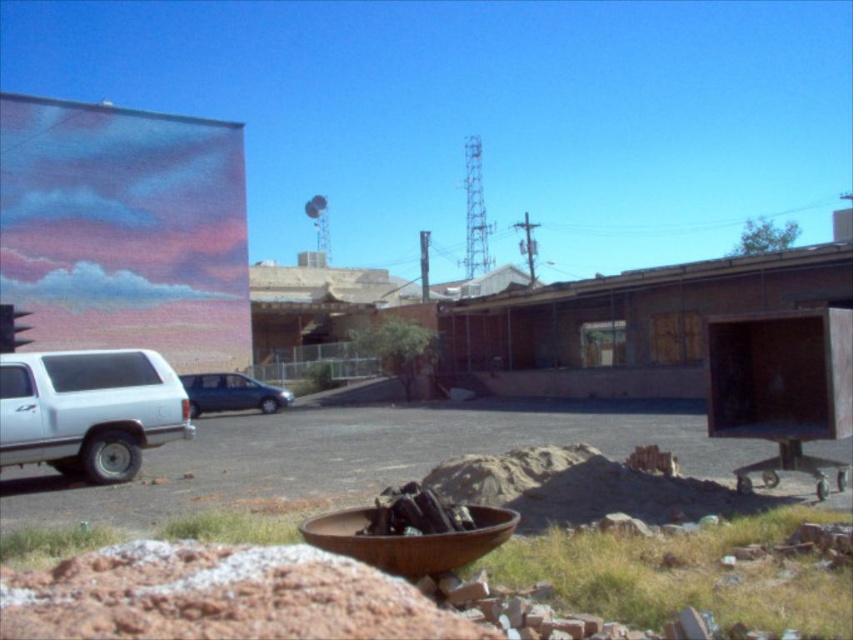
How much distance is there between white matte truck at left and satin blue sedan at center?

white matte truck at left is 15.66 meters from satin blue sedan at center.

Between point (160, 428) and point (227, 384), which one is positioned behind?

Positioned behind is point (227, 384).

Where is `white matte truck at left`? The image size is (853, 640). white matte truck at left is located at coordinates (88, 410).